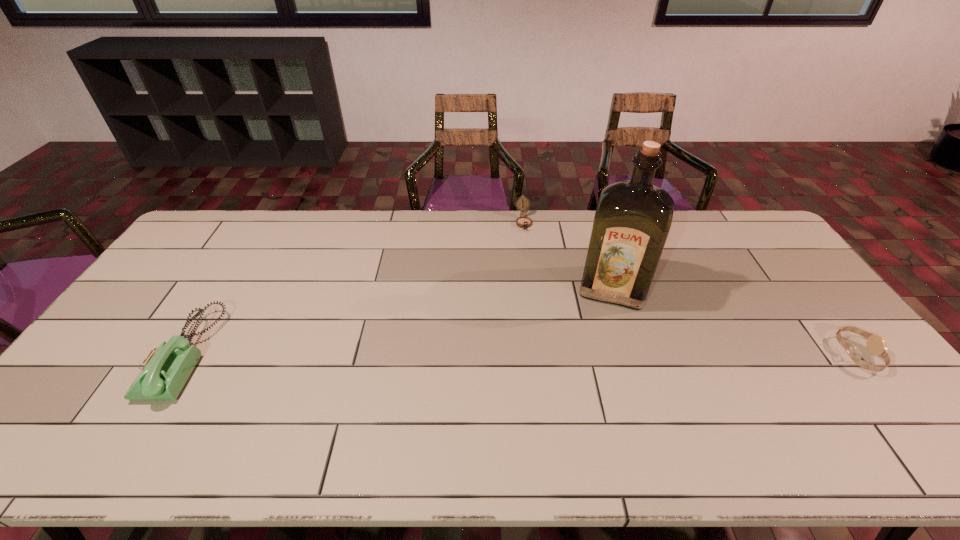
Where is `vacant region that satisfies the following two spatial constraints: 1. on the front side of the second shortest object; 2. on the left side of the third object from left to right`? vacant region that satisfies the following two spatial constraints: 1. on the front side of the second shortest object; 2. on the left side of the third object from left to right is located at coordinates (532, 288).